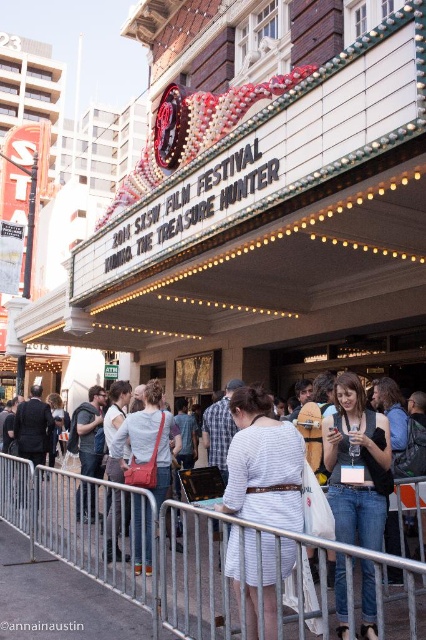
Question: Which object appears closest to the camera in this image?

Choices:
 (A) denim jeans at center
 (B) dark gray suit at center
 (C) light blue denim jeans at center

Answer: (A)

Question: Among these objects, which one is nearest to the camera?

Choices:
 (A) denim jeans at center
 (B) silver metallic fence at center

Answer: (B)

Question: Is white striped dress at center further to the viewer compared to dark gray hoodie at center?

Choices:
 (A) yes
 (B) no

Answer: (B)

Question: Does silver metallic fence at center have a larger size compared to dark gray suit at center?

Choices:
 (A) yes
 (B) no

Answer: (A)

Question: Which point is closer to the camera?

Choices:
 (A) (95, 452)
 (B) (34, 397)
 (C) (336, 460)

Answer: (C)

Question: Can you confirm if white striped dress at center is smaller than dark gray hoodie at center?

Choices:
 (A) no
 (B) yes

Answer: (B)